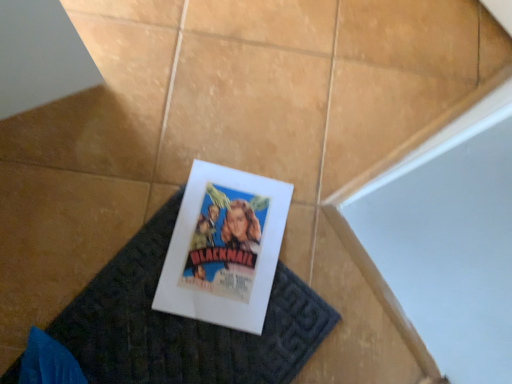
Image resolution: width=512 pixels, height=384 pixels. What do you see at coordinates (224, 248) in the screenshot?
I see `matte paper poster at center` at bounding box center [224, 248].

In order to click on matte paper poster at center in this screenshot , I will do `click(224, 248)`.

Measure the distance between point (x=250, y=274) and camera.

Point (x=250, y=274) is 32.32 inches away from camera.

Measure the distance between dark gray textured doormat at center and camera.

The distance of dark gray textured doormat at center from camera is 30.12 inches.

What do you see at coordinates (183, 324) in the screenshot? The height and width of the screenshot is (384, 512). I see `dark gray textured doormat at center` at bounding box center [183, 324].

Find the location of a particular element. dark gray textured doormat at center is located at coordinates (183, 324).

The width and height of the screenshot is (512, 384). I want to click on matte paper poster at center, so click(224, 248).

Considering the positions of objects dark gray textured doormat at center and matte paper poster at center in the image provided, who is more to the right, dark gray textured doormat at center or matte paper poster at center?

From the viewer's perspective, matte paper poster at center appears more on the right side.

Is dark gray textured doormat at center in front of matte paper poster at center?

Yes, it is.

Between point (238, 345) and point (228, 302), which one is positioned in front?

The point (238, 345) is closer to the camera.

From the image's perspective, is dark gray textured doormat at center on matte paper poster at center?

No, from the image's perspective, dark gray textured doormat at center is not over matte paper poster at center.

From a real-world perspective, between dark gray textured doormat at center and matte paper poster at center, who is vertically higher?

matte paper poster at center, from a real-world perspective.

Looking at their sizes, would you say dark gray textured doormat at center is wider or thinner than matte paper poster at center?

Considering their sizes, dark gray textured doormat at center looks broader than matte paper poster at center.

Between dark gray textured doormat at center and matte paper poster at center, which one has less height?

dark gray textured doormat at center.

Looking at the image, does dark gray textured doormat at center seem bigger or smaller compared to matte paper poster at center?

In the image, dark gray textured doormat at center appears to be larger than matte paper poster at center.

Does dark gray textured doormat at center contain matte paper poster at center?

Yes, matte paper poster at center is a part of dark gray textured doormat at center.

Is dark gray textured doormat at center not near matte paper poster at center?

No.

Could you tell me if dark gray textured doormat at center is facing matte paper poster at center?

Yes.

This screenshot has height=384, width=512. I want to click on doormat in front of the matte paper poster at center, so click(183, 324).

In the image, is matte paper poster at center on the left side or the right side of dark gray textured doormat at center?

Based on their positions, matte paper poster at center is located to the right of dark gray textured doormat at center.

Is matte paper poster at center in front of or behind dark gray textured doormat at center in the image?

Clearly, matte paper poster at center is behind dark gray textured doormat at center.

Which point is more distant from viewer, (x=275, y=213) or (x=106, y=273)?

The point (x=275, y=213) is farther from the camera.

Based on the photo, from the image's perspective, is matte paper poster at center located above or below dark gray textured doormat at center?

Based on their image positions, matte paper poster at center is located above dark gray textured doormat at center.

From a real-world perspective, is matte paper poster at center physically located above or below dark gray textured doormat at center?

Clearly, from a real-world perspective, matte paper poster at center is above dark gray textured doormat at center.

Considering the relative sizes of matte paper poster at center and dark gray textured doormat at center in the image provided, is matte paper poster at center thinner than dark gray textured doormat at center?

Correct, the width of matte paper poster at center is less than that of dark gray textured doormat at center.

Who is shorter, matte paper poster at center or dark gray textured doormat at center?

With less height is dark gray textured doormat at center.

Based on their sizes in the image, would you say matte paper poster at center is bigger or smaller than dark gray textured doormat at center?

In the image, matte paper poster at center appears to be smaller than dark gray textured doormat at center.

Would you say matte paper poster at center contains dark gray textured doormat at center?

No, dark gray textured doormat at center is not inside matte paper poster at center.

Are matte paper poster at center and dark gray textured doormat at center far apart?

Actually, matte paper poster at center and dark gray textured doormat at center are a little close together.

Is matte paper poster at center looking in the opposite direction of dark gray textured doormat at center?

Yes.

Can you tell me how much matte paper poster at center and dark gray textured doormat at center differ in facing direction?

The angular difference between matte paper poster at center and dark gray textured doormat at center is 31.4 degrees.

Image resolution: width=512 pixels, height=384 pixels. I want to click on poster located behind the dark gray textured doormat at center, so click(x=224, y=248).

This screenshot has height=384, width=512. There is a dark gray textured doormat at center. Find the location of `poster above it (from a real-world perspective)`. poster above it (from a real-world perspective) is located at coordinates (224, 248).

Where is `poster above the dark gray textured doormat at center (from the image's perspective)`? poster above the dark gray textured doormat at center (from the image's perspective) is located at coordinates (224, 248).